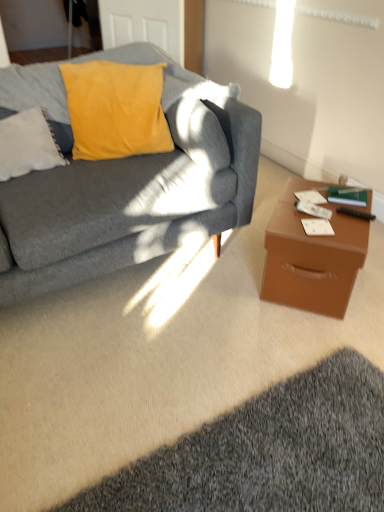
What are the coordinates of `free space to the left of dark gray shaggy rug at lower right` in the screenshot? It's located at (77, 399).